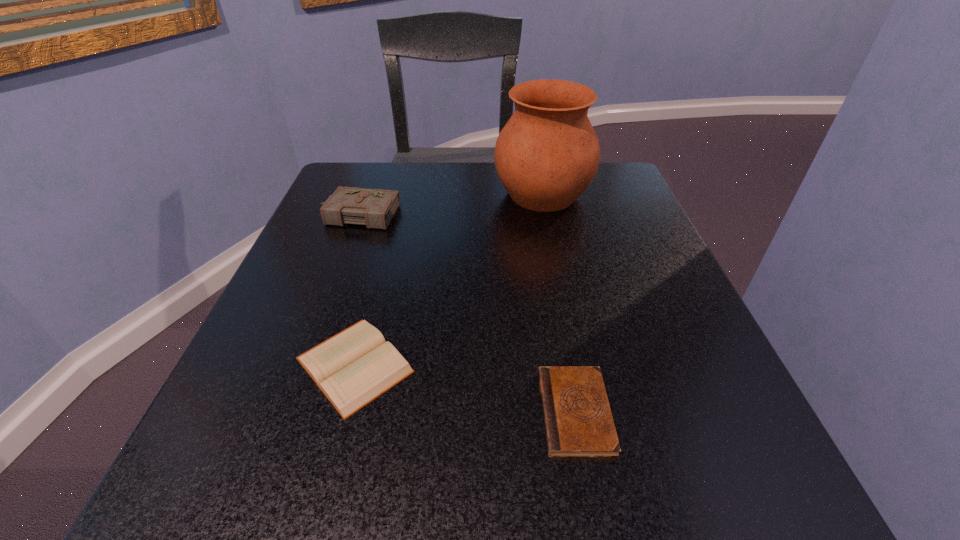
Locate an element on the screen. The height and width of the screenshot is (540, 960). vacant space located on the spine side of the rightmost diary is located at coordinates (357, 412).

Where is `free space located on the spine side of the rightmost diary`? free space located on the spine side of the rightmost diary is located at coordinates (504, 412).

At what (x,y) coordinates should I click in order to perform the action: click on pottery that is at the far edge. Please return your answer as a coordinate pair (x, y). This screenshot has width=960, height=540. Looking at the image, I should click on (547, 154).

This screenshot has width=960, height=540. What are the coordinates of `diary present at the far edge` in the screenshot? It's located at (375, 208).

Identify the location of object positioned at the near edge. The width and height of the screenshot is (960, 540). (578, 422).

You are a GUI agent. You are given a task and a screenshot of the screen. Output one action in this format:
    pyautogui.click(x=<x>, y=<y>)
    Task: Click on the object positioned at the right edge
    
    Given the screenshot: What is the action you would take?
    pyautogui.click(x=547, y=154)

What are the coordinates of `object present at the far left corner` in the screenshot? It's located at (375, 208).

Identify the location of object situated at the far right corner. The height and width of the screenshot is (540, 960). (547, 154).

The width and height of the screenshot is (960, 540). I want to click on free space at the far edge, so click(x=400, y=194).

Identify the location of vacant region at the near edge of the desktop. 548,512.